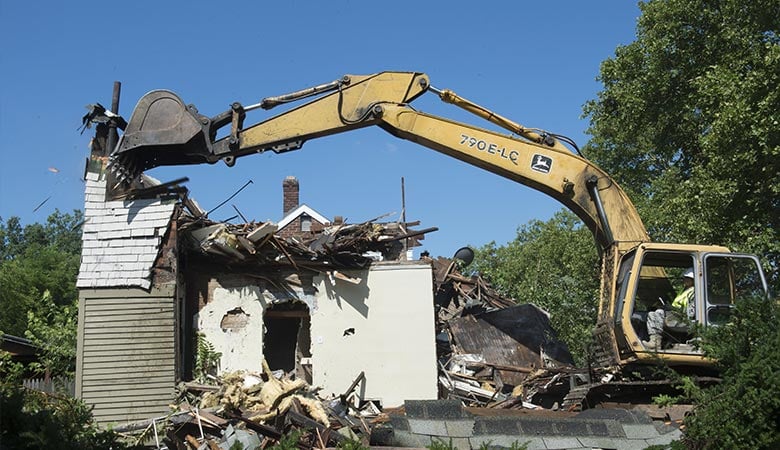
Image resolution: width=780 pixels, height=450 pixels. I want to click on chimney, so click(x=292, y=188).